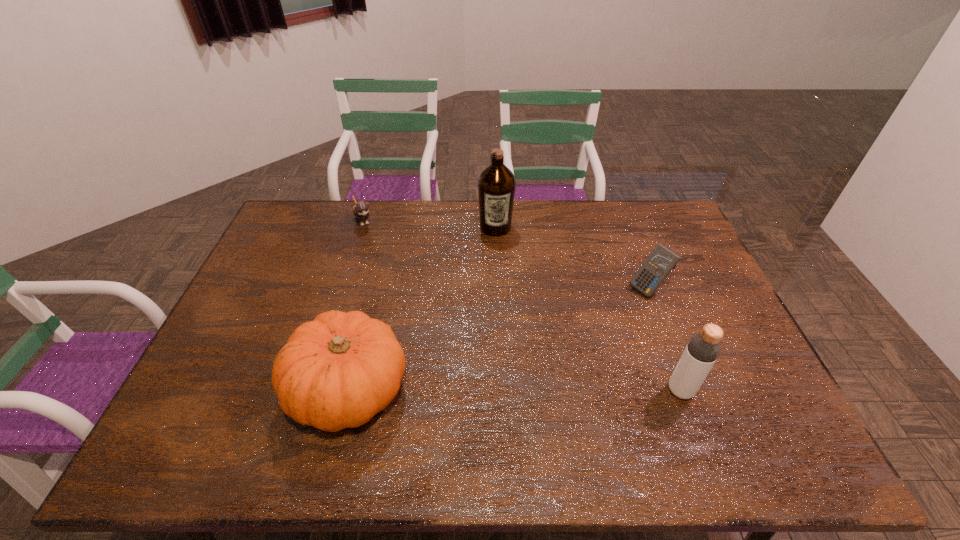
This screenshot has width=960, height=540. I want to click on free space between the fourth shortest object and the pumpkin, so click(x=515, y=390).

Where is `vacant region between the shortest object and the olive oil`? vacant region between the shortest object and the olive oil is located at coordinates (429, 224).

Find the location of a particular element. empty space that is in between the third farthest object and the shortest object is located at coordinates (506, 254).

Where is `vacant point located between the third nearest object and the tallest object`? Image resolution: width=960 pixels, height=540 pixels. vacant point located between the third nearest object and the tallest object is located at coordinates (572, 258).

Find the location of a particular element. The height and width of the screenshot is (540, 960). unoccupied position between the third tallest object and the bottle is located at coordinates (x=515, y=390).

At what (x,y) coordinates should I click in order to perform the action: click on vacant space in between the shortest object and the bottle. Please return your answer as a coordinate pair (x, y). The image size is (960, 540). Looking at the image, I should click on (522, 305).

Find the location of a particular element. blank region between the bottle and the third shortest object is located at coordinates (515, 390).

I want to click on free space that is in between the kitten and the olive oil, so click(x=429, y=224).

Find the location of a particular element. empty location between the bottle and the second shortest object is located at coordinates (664, 340).

Find the location of a particular element. Image resolution: width=960 pixels, height=540 pixels. object that stands as the closest to the fourth shortest object is located at coordinates (661, 261).